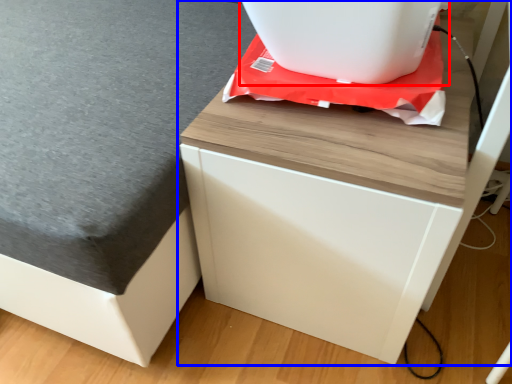
Question: Which object is further to the camera taking this photo, appliance (highlighted by a red box) or furniture (highlighted by a blue box)?

Choices:
 (A) appliance
 (B) furniture

Answer: (A)